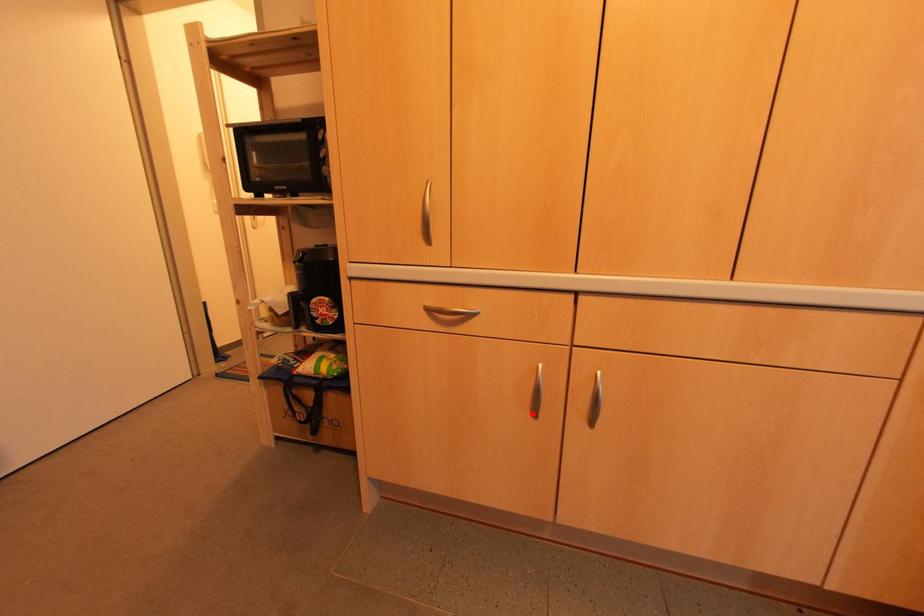
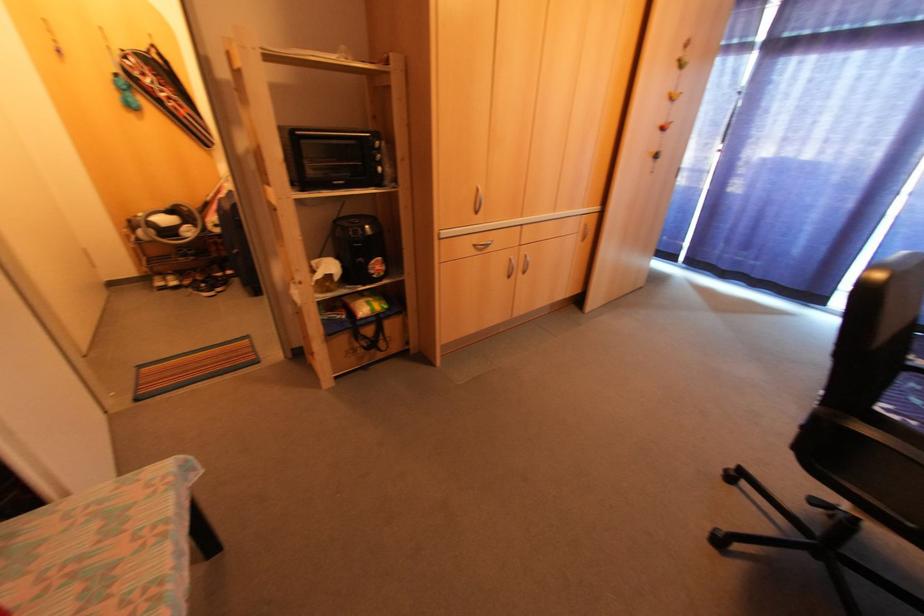
In the second image, find the point that corresponds to the highlighted location in the first image.

(506, 277)